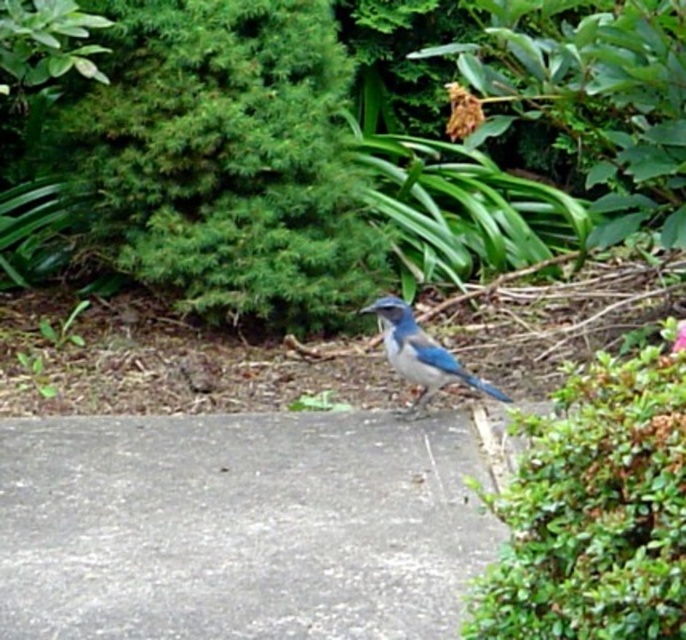
You are a birdwatcher observing the Western Scrub Jay in the scene. You notice the gray concrete pavement at center and the green leafy bush at right. Which object is positioned lower in the image?

The gray concrete pavement at center is located below the green leafy bush at right, so it is positioned lower in the image.

You are a bird flying towards the gray concrete pavement at center and the green leafy bush at right. Which object will you reach first?

You will reach the gray concrete pavement at center first because it is closer to you than the green leafy bush at right, which is further away.